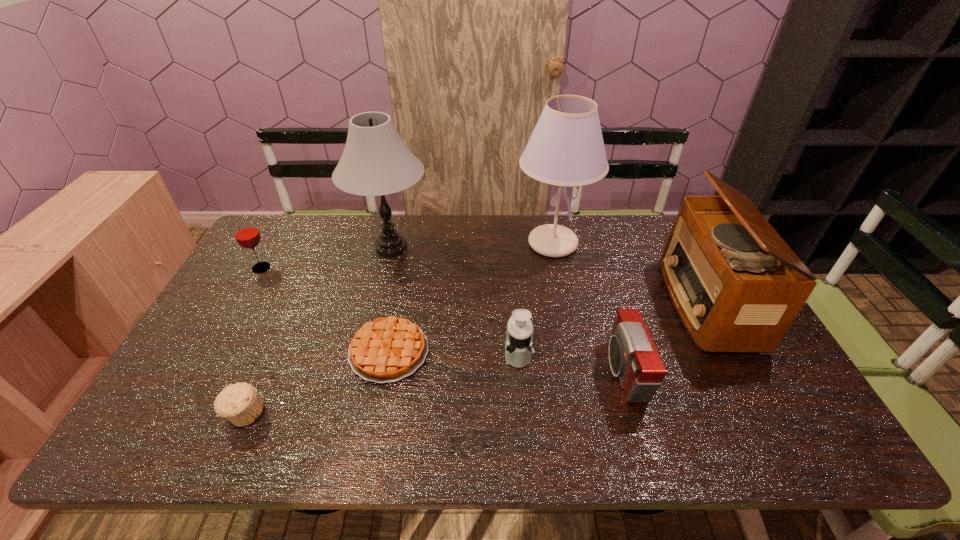
What are the coordinates of `free space located 0.250m on the front of the lampshade` in the screenshot? It's located at (569, 328).

Locate an element on the screen. The height and width of the screenshot is (540, 960). vacant space located 0.210m on the front of the lamp is located at coordinates (372, 324).

You are a GUI agent. You are given a task and a screenshot of the screen. Output one action in this format:
    pyautogui.click(x=<x>, y=<y>)
    Task: Click on the vacant area located on the front panel of the radio receiver
    The height and width of the screenshot is (540, 960).
    Given the screenshot: What is the action you would take?
    pyautogui.click(x=616, y=303)

I want to click on free space located 0.350m on the front panel of the radio receiver, so click(x=551, y=303).

This screenshot has height=540, width=960. In order to click on free location located 0.090m on the front panel of the radio receiver in this screenshot , I will do `click(640, 303)`.

This screenshot has width=960, height=540. What are the coordinates of `vacant space located 0.320m on the right of the leftmost object` in the screenshot? It's located at (372, 268).

This screenshot has width=960, height=540. What are the coordinates of `vacant space located on the back of the juicer` in the screenshot? It's located at (515, 319).

Where is `vacant position located 0.230m on the front-facing side of the camera`? The width and height of the screenshot is (960, 540). vacant position located 0.230m on the front-facing side of the camera is located at coordinates (516, 371).

I want to click on vacant position located 0.270m on the front-facing side of the camera, so [x=500, y=371].

You are a GUI agent. You are given a task and a screenshot of the screen. Output one action in this format:
    pyautogui.click(x=<x>, y=<y>)
    Task: Click on the free space located on the front-facing side of the camera
    The height and width of the screenshot is (540, 960).
    Given the screenshot: What is the action you would take?
    pyautogui.click(x=505, y=371)